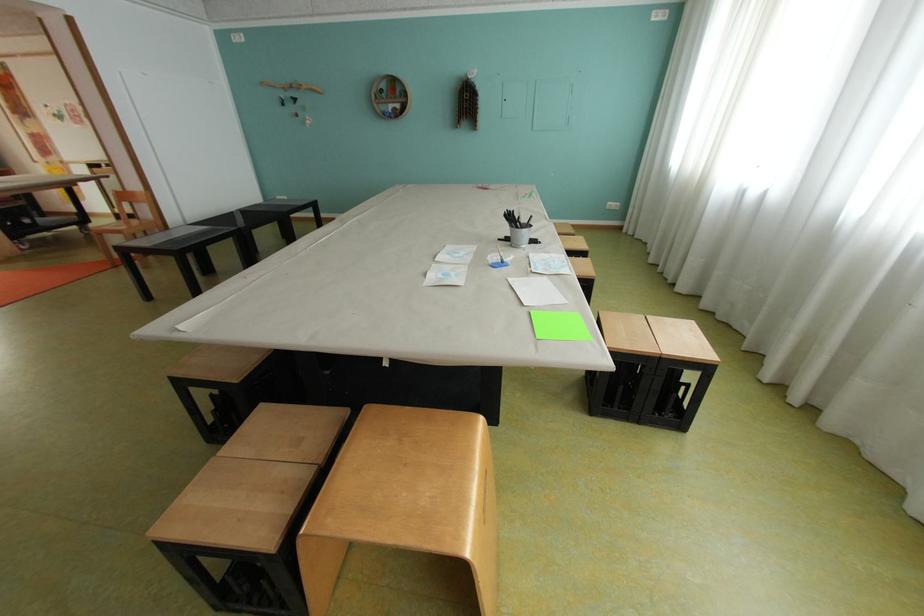
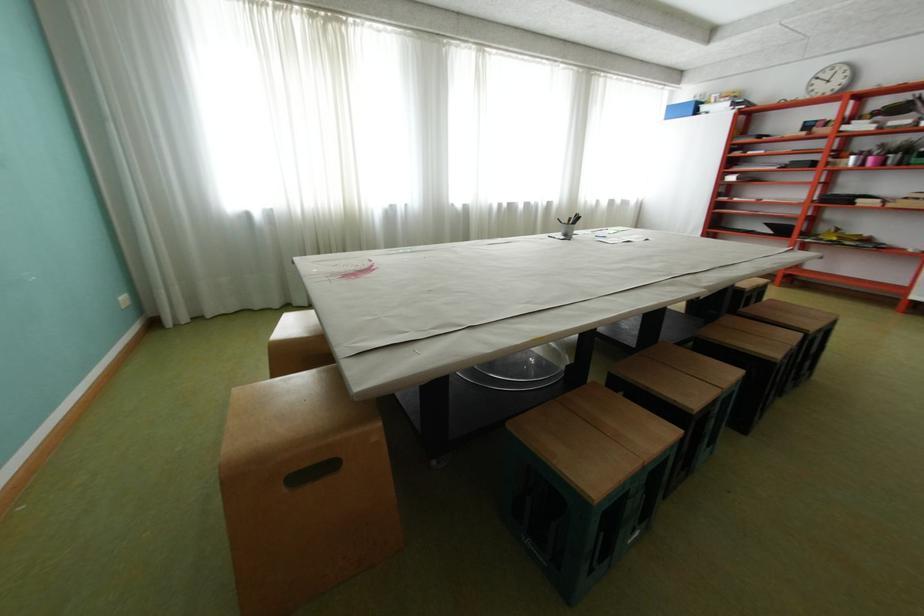
The point at (541,217) is marked in the first image. Where is the corresponding point in the second image?

(568, 219)